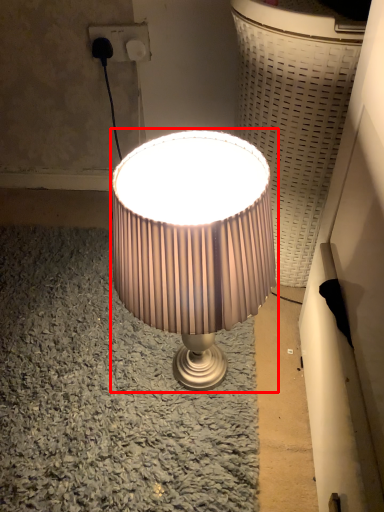
Question: From the image's perspective, what is the correct spatial relationship of lamp (annotated by the red box) in relation to electric outlet?

Choices:
 (A) above
 (B) below

Answer: (B)